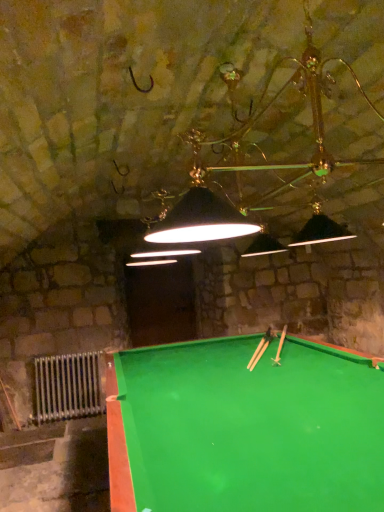
Identify the location of free space in front of green plastic cue at center, which is counted as the 2th cue, starting from the bottom. (284, 365).